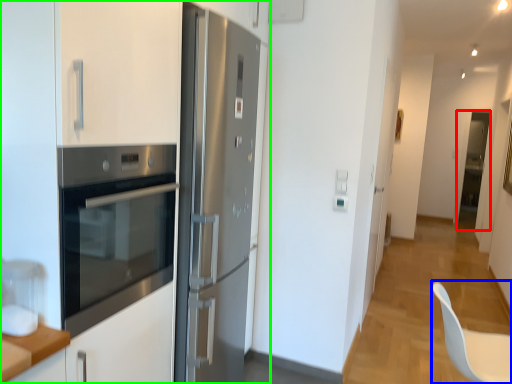
Question: Considering the real-world distances, which object is farthest from glass door (highlighted by a red box)? swivel chair (highlighted by a blue box) or cabinetry (highlighted by a green box)?

Choices:
 (A) swivel chair
 (B) cabinetry

Answer: (B)